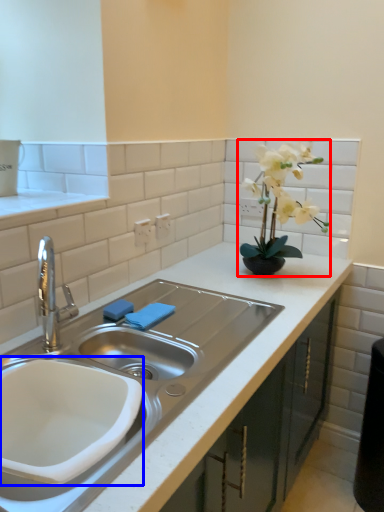
Question: Which of the following is the farthest to the observer, houseplant (highlighted by a red box) or sink (highlighted by a blue box)?

Choices:
 (A) houseplant
 (B) sink

Answer: (A)